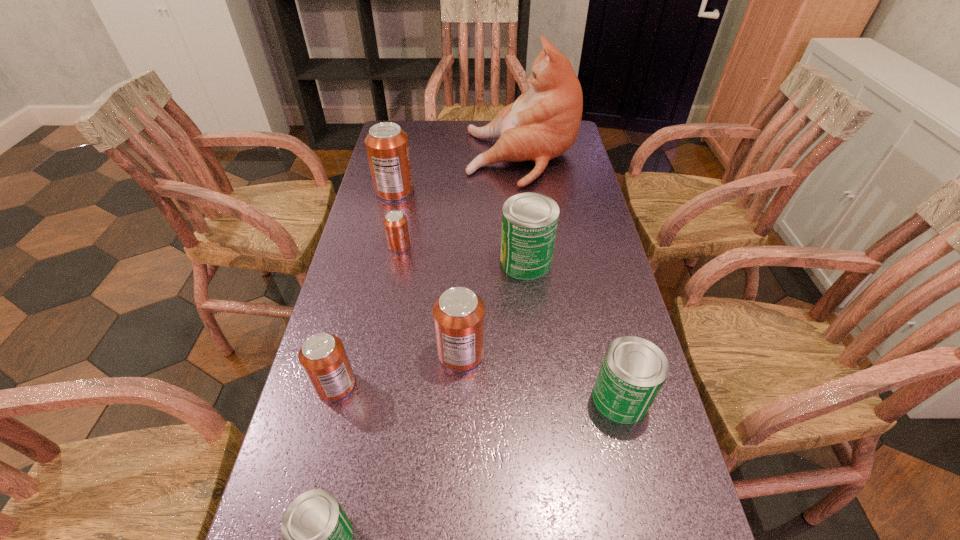
The width and height of the screenshot is (960, 540). I want to click on vacant area that satisfies the following two spatial constraints: 1. on the face of the rightmost green can; 2. on the right side of the orange cat, so click(x=551, y=399).

Image resolution: width=960 pixels, height=540 pixels. Find the location of `free spot that satisfies the following two spatial constraints: 1. on the front side of the biggest green can; 2. on the right side of the smallest orange can`. free spot that satisfies the following two spatial constraints: 1. on the front side of the biggest green can; 2. on the right side of the smallest orange can is located at coordinates (396, 261).